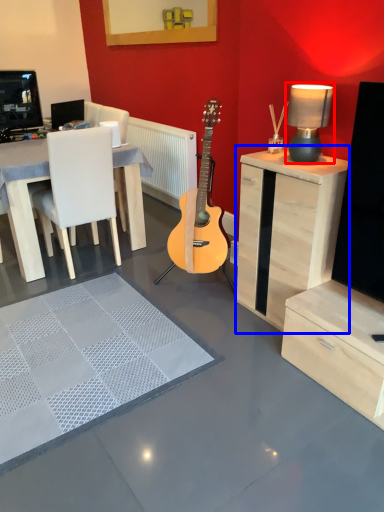
Question: Which object appears closest to the camera in this image, table lamp (highlighted by a red box) or cabinetry (highlighted by a blue box)?

Choices:
 (A) table lamp
 (B) cabinetry

Answer: (B)